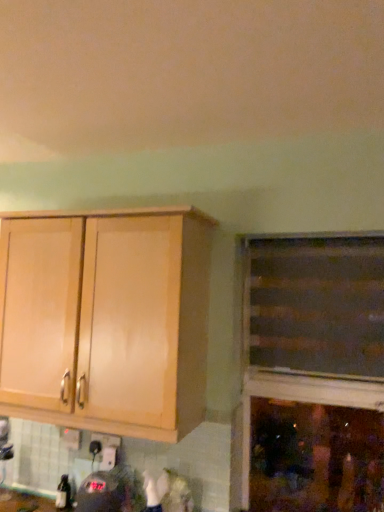
Question: Does white plastic electric outlet at lower center have a greater height compared to light wood cabinet at left, which ranks as the 2th cabinetry in right-to-left order?

Choices:
 (A) no
 (B) yes

Answer: (A)

Question: From a real-world perspective, does white plastic electric outlet at lower center stand above light wood cabinet at left, placed as the 1th cabinetry when sorted from left to right?

Choices:
 (A) no
 (B) yes

Answer: (A)

Question: Can you confirm if white plastic electric outlet at lower center is thinner than light wood cabinet at left, placed as the 1th cabinetry when sorted from left to right?

Choices:
 (A) yes
 (B) no

Answer: (A)

Question: From a real-world perspective, is white plastic electric outlet at lower center under light wood cabinet at left, which ranks as the 2th cabinetry in right-to-left order?

Choices:
 (A) no
 (B) yes

Answer: (B)

Question: Is light wood cabinet at left, placed as the 1th cabinetry when sorted from left to right, completely or partially inside white plastic electric outlet at lower center?

Choices:
 (A) yes
 (B) no

Answer: (B)

Question: From the image's perspective, is white plastic electric outlet at lower center on top of light wood cabinet at left, placed as the 1th cabinetry when sorted from left to right?

Choices:
 (A) no
 (B) yes

Answer: (A)

Question: Does white plastic electric outlet at lower center have a smaller size compared to wooden cabinet at right, acting as the second cabinetry starting from the left?

Choices:
 (A) yes
 (B) no

Answer: (A)

Question: Can you confirm if white plastic electric outlet at lower center is positioned to the right of wooden cabinet at right, which is the 1th cabinetry from right to left?

Choices:
 (A) yes
 (B) no

Answer: (B)

Question: Is wooden cabinet at right, which is the 1th cabinetry from right to left, surrounded by white plastic electric outlet at lower center?

Choices:
 (A) no
 (B) yes

Answer: (A)

Question: Is wooden cabinet at right, which is the 1th cabinetry from right to left, at the back of white plastic electric outlet at lower center?

Choices:
 (A) no
 (B) yes

Answer: (A)

Question: Is white plastic electric outlet at lower center thinner than wooden cabinet at right, acting as the second cabinetry starting from the left?

Choices:
 (A) yes
 (B) no

Answer: (A)

Question: Is white plastic electric outlet at lower center positioned behind wooden cabinet at right, which is the 1th cabinetry from right to left?

Choices:
 (A) no
 (B) yes

Answer: (B)

Question: Does light wood cabinet at left, which ranks as the 2th cabinetry in right-to-left order, appear on the right side of white plastic electric outlet at lower center?

Choices:
 (A) yes
 (B) no

Answer: (A)